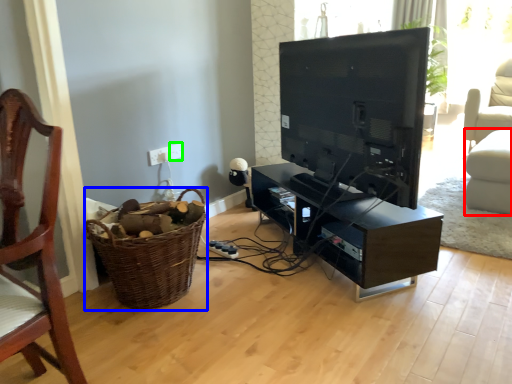
Question: Estimate the real-world distances between objects in this image. Which object is farther from swivel chair (highlighted by a red box), basket (highlighted by a blue box) or electric outlet (highlighted by a green box)?

Choices:
 (A) basket
 (B) electric outlet

Answer: (A)